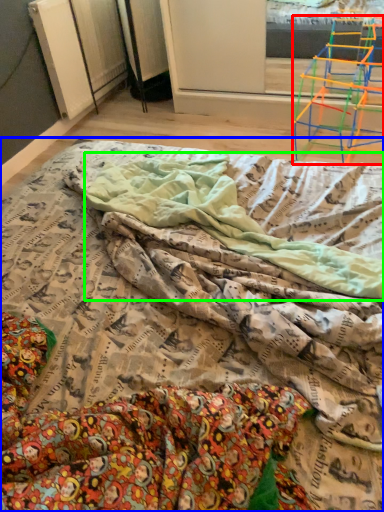
Question: Which object is the closest to the furniture (highlighted by a red box)? Choose among these: bed (highlighted by a blue box) or blanket (highlighted by a green box).

Choices:
 (A) bed
 (B) blanket

Answer: (B)